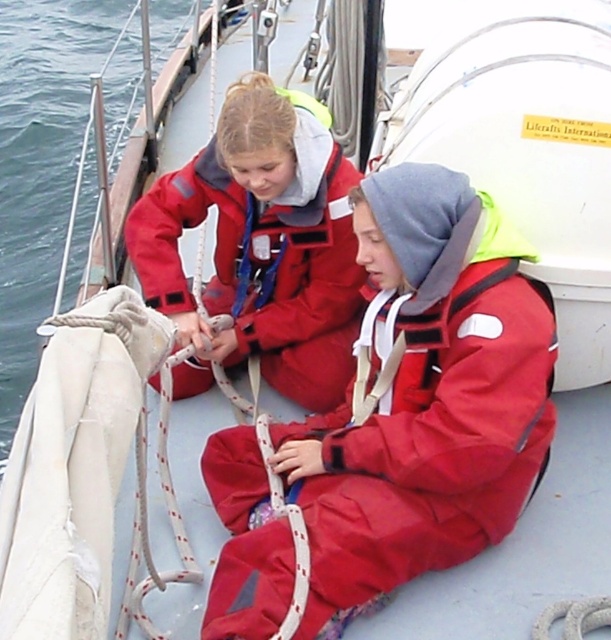
You are a safety inspector checking the equipment on the sailboat deck. You need to ensure that the red matte life jacket at center can fit over the matte red jacket at upper left. Based on their widths, is this possible?

The red matte life jacket at center might be wider than matte red jacket at upper left, so it is possible that the life jacket can fit over the matte red jacket at upper left if its width allows.

You are a sailor on the deck of the sailboat and need to quickly grab the red matte life jacket at center. Based on its coordinates, can you estimate its position relative to the ropes?

The red matte life jacket at center is located at point coordinates, which places it centrally on the deck between the individuals and the ropes they are handling. It is likely positioned in a central storage area or near the winch, making it accessible for quick retrieval during operations.